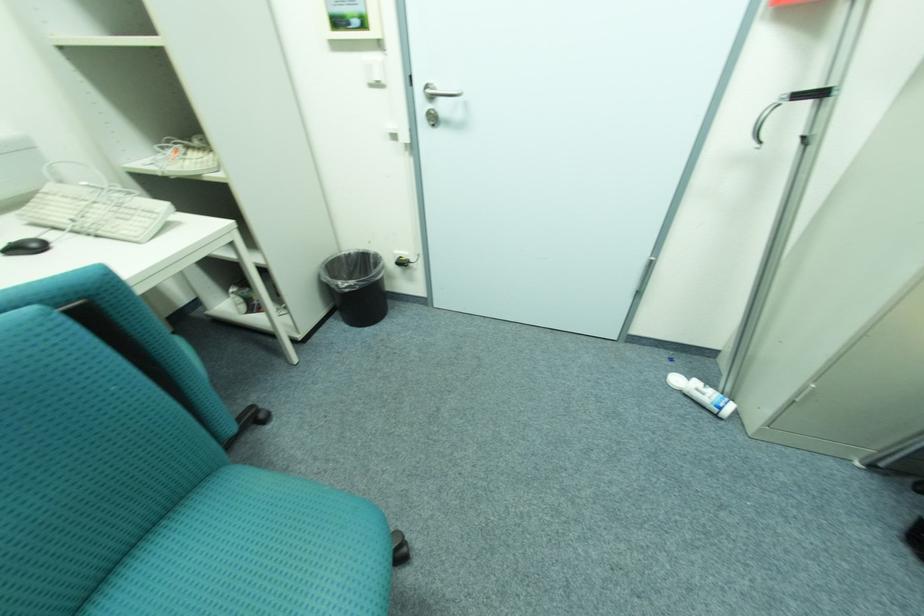
Where is `door keyhole`? The height and width of the screenshot is (616, 924). door keyhole is located at coordinates (432, 116).